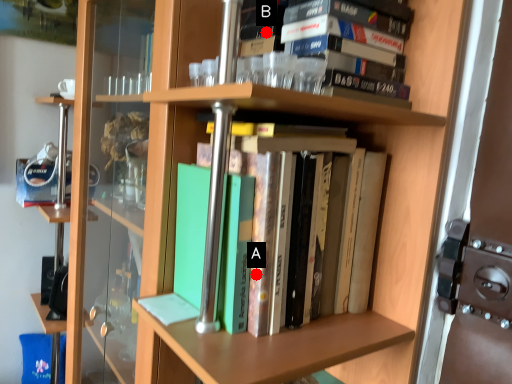
Question: Two points are circled on the image, labeled by A and B beside each circle. Among these points, which one is farthest from the camera?

Choices:
 (A) A is further
 (B) B is further

Answer: (B)